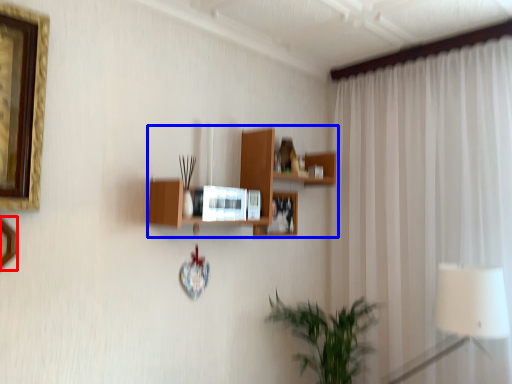
Question: Among these objects, which one is farthest to the camera, picture frame (highlighted by a red box) or shelf (highlighted by a blue box)?

Choices:
 (A) picture frame
 (B) shelf

Answer: (B)